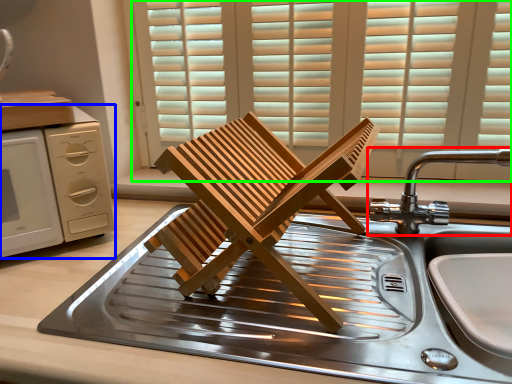
Question: Which object is the farthest from tap (highlighted by a red box)? Choose among these: home appliance (highlighted by a blue box) or window (highlighted by a green box).

Choices:
 (A) home appliance
 (B) window

Answer: (A)